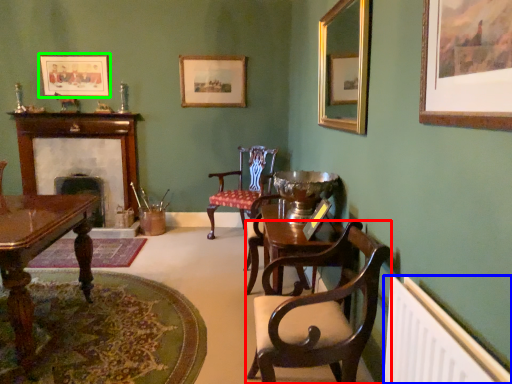
Question: Estimate the real-world distances between objects in this image. Which object is closer to chair (highlighted by a red box), radiator (highlighted by a blue box) or picture frame (highlighted by a green box)?

Choices:
 (A) radiator
 (B) picture frame

Answer: (A)